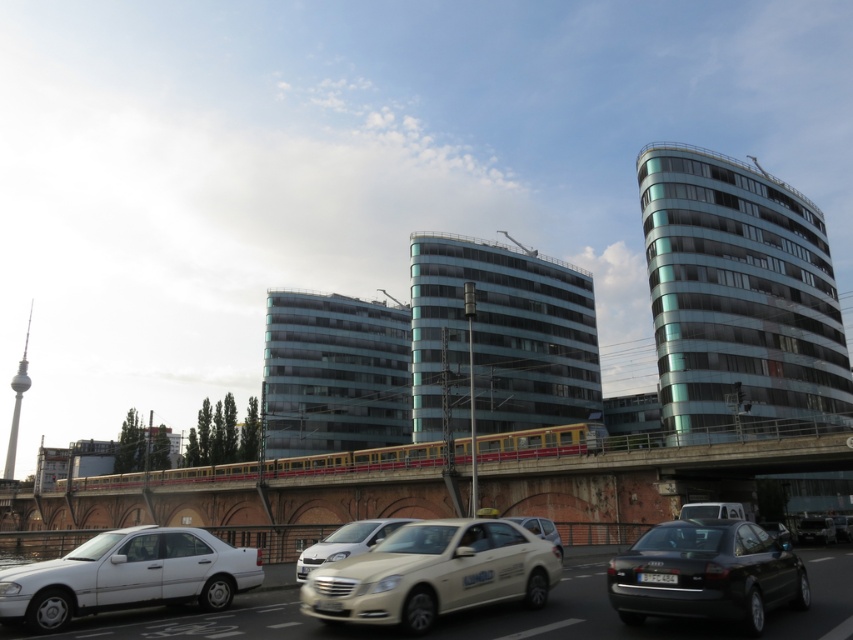
You are a construction worker standing on the concrete bridge at center. You need to place a safety barrier that requires a distance of at least 15 meters between the barrier and the camera. Is the current distance sufficient?

The concrete bridge at center and camera are 15.45 meters apart from each other, which is more than the required 15 meters. Therefore, the current distance is sufficient for placing the safety barrier.

You are standing at the point marked as point [433,573] in the image. What object is exactly at that location?

The white glossy taxi at center is exactly at point [433,573].

You are a delivery person trying to park your 1.8 meters tall delivery box between the matte silver sedan at center and the metallic silver sedan at center. Can the delivery box fit vertically between them?

The matte silver sedan at center is taller than the metallic silver sedan at center, so the vertical space between them would depend on their height difference. However, since the delivery box is 1.8 meters tall, it might not fit if the space between the sedans is less than 1.8 meters. The exact height difference isn not provided, so we cannot confirm for sure.